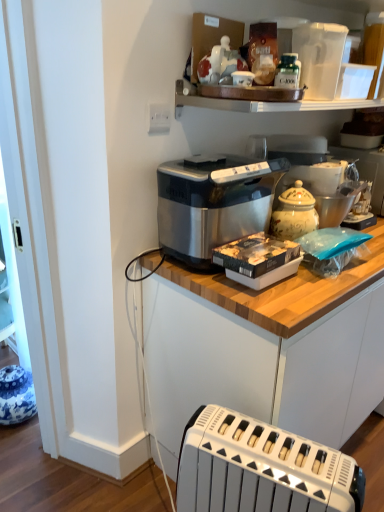
Where is `vacant area on top of white plastic toaster at lower center (from a real-world perspective)`? This screenshot has height=512, width=384. vacant area on top of white plastic toaster at lower center (from a real-world perspective) is located at coordinates click(273, 451).